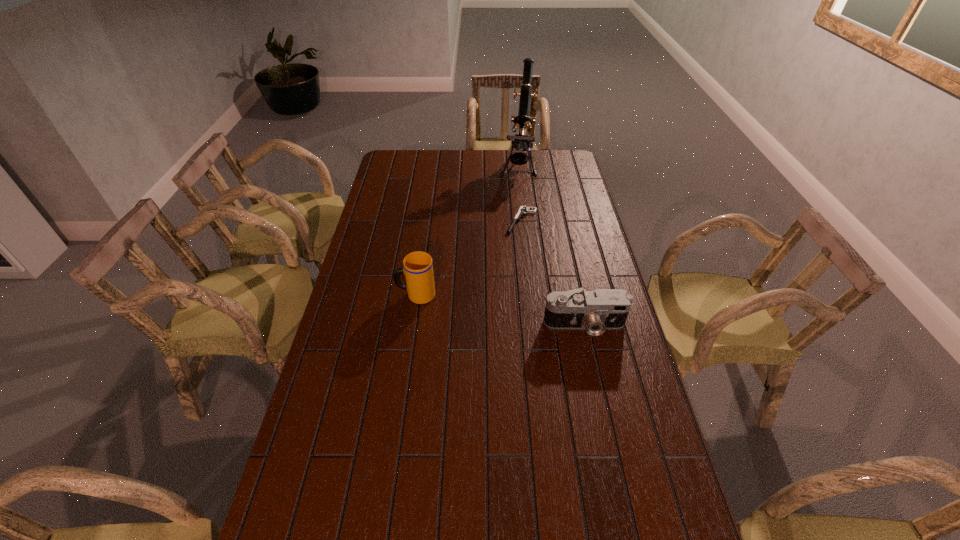
At what (x,y) coordinates should I click in order to perform the action: click on vacant space in between the nearest object and the microscope. Please return your answer as a coordinate pair (x, y). This screenshot has width=960, height=540. Looking at the image, I should click on 551,246.

This screenshot has height=540, width=960. Identify the location of free space between the camera and the cup. [500, 310].

Identify the location of vacant region between the nearest object and the second nearest object. The width and height of the screenshot is (960, 540). (500, 310).

Image resolution: width=960 pixels, height=540 pixels. I want to click on empty location between the cup and the third tallest object, so click(x=500, y=310).

Where is `object that is the second closest to the camera`? object that is the second closest to the camera is located at coordinates (523, 209).

Identify which object is the third nearest to the second farthest object. Please provide its 2D coordinates. Your answer should be formatted as a tuple, i.e. [(x, y)], where the tuple contains the x and y coordinates of a point satisfying the conditions above.

[(595, 311)]